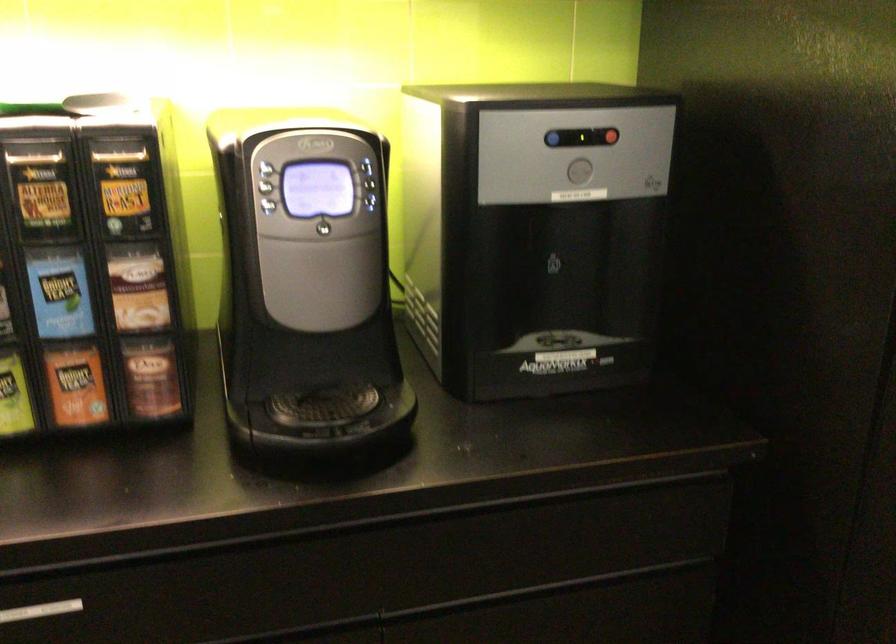
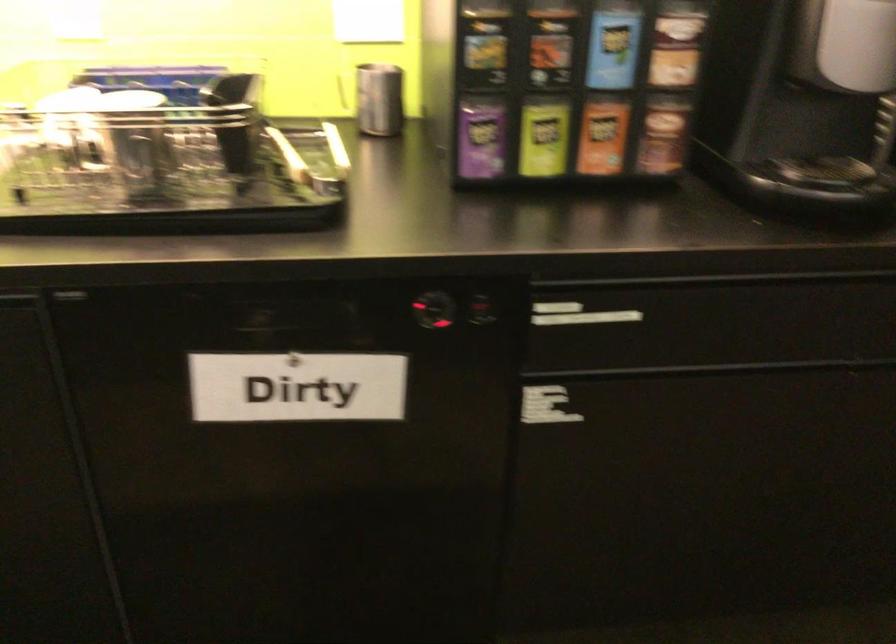
Locate, in the second image, the point that corresponds to point 82,381 in the first image.

(602, 136)